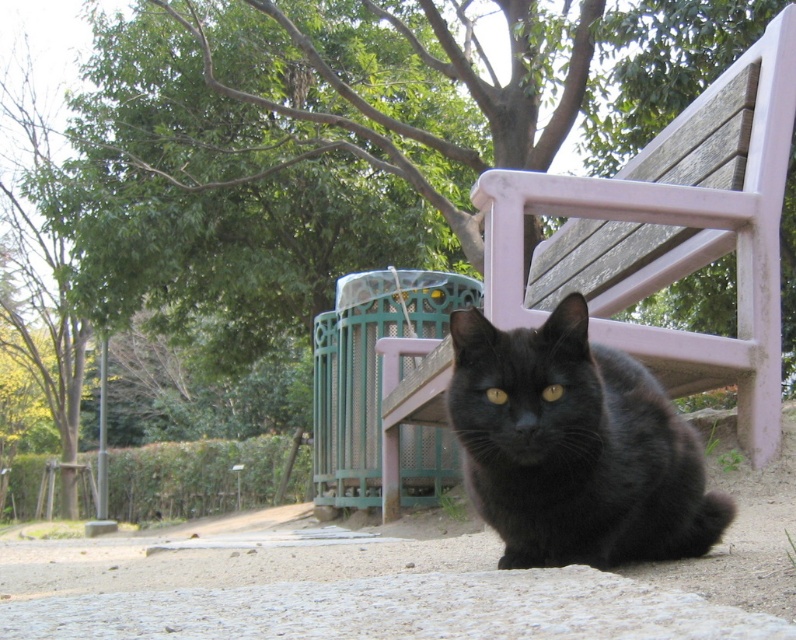
Between wooden park bench at center and black fur cat at center, which one is positioned higher?

wooden park bench at center

Which is behind, point (707, 118) or point (648, 374)?

Positioned behind is point (707, 118).

You are a GUI agent. You are given a task and a screenshot of the screen. Output one action in this format:
    pyautogui.click(x=<x>, y=<y>)
    Task: Click on the wooden park bench at center
    
    Given the screenshot: What is the action you would take?
    668,236